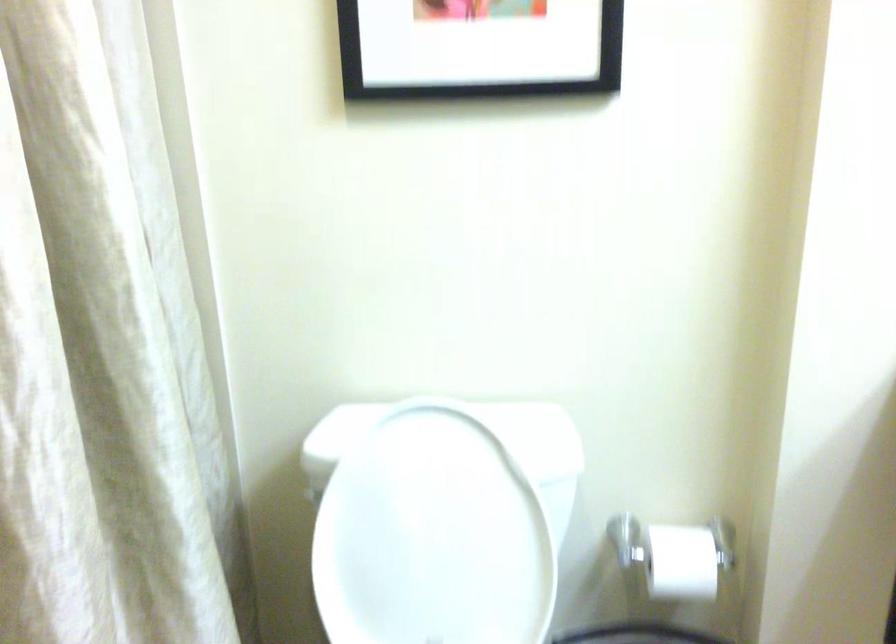
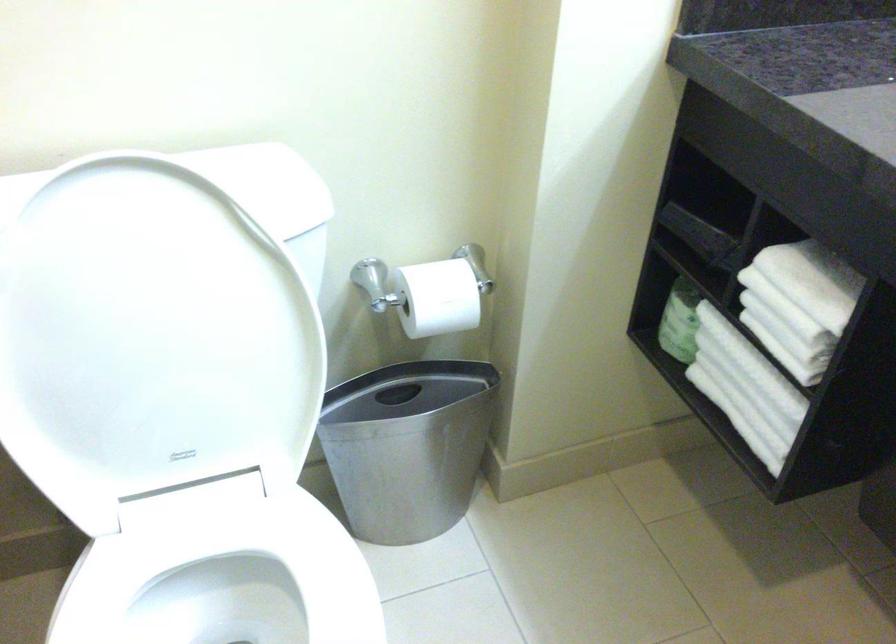
In the second image, find the point that corresponds to (431,527) in the first image.

(159, 323)